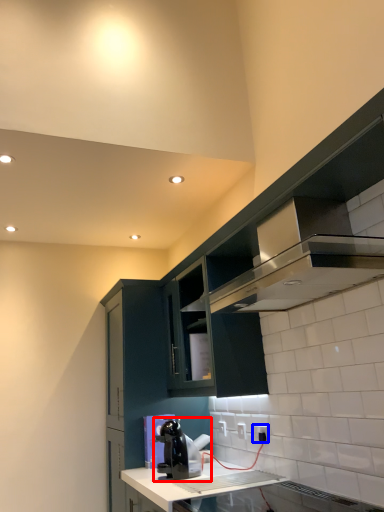
Question: Which object appears farthest to the camera in this image, home appliance (highlighted by a red box) or electric outlet (highlighted by a blue box)?

Choices:
 (A) home appliance
 (B) electric outlet

Answer: (B)